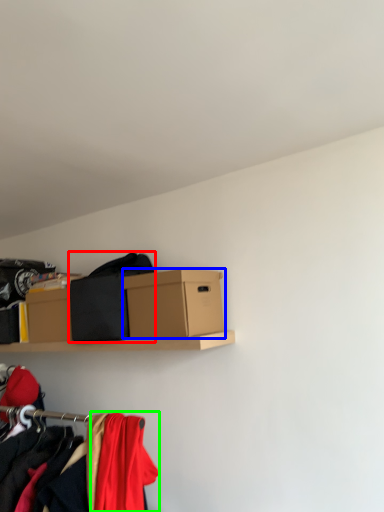
Question: Based on their relative distances, which object is nearer to clothing (highlighted by a red box)? Choose from box (highlighted by a blue box) and clothing (highlighted by a green box).

Choices:
 (A) box
 (B) clothing

Answer: (A)